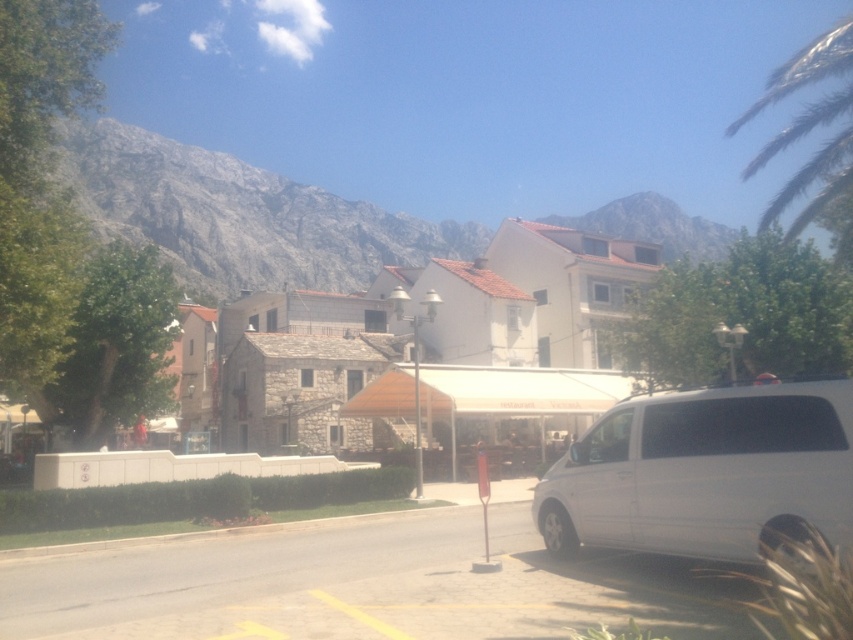
You are driving a delivery truck that is 6 meters long. You need to park your truck in the street where the white matte minivan at lower right is currently parked. Is there enough space to park your truck without overlapping the minivan?

The distance between the white matte minivan at lower right and the other object is 7.04 meters. Since your truck is 6 meters long, there is enough space to park without overlapping the minivan.

You are a hiker planning to take a photo of the gray rock mountain at upper left from the town square. Based on its position in the image, which direction should you face to capture it in your shot?

The gray rock mountain at upper left is located at point (241,216), which corresponds to the upper left area of the image. To capture it, you should face towards the upper left direction from the town square.

You are planning to install a new communication tower between the gray rock mountain at upper left and the green leafy palm tree at upper right. Considering the distance between them, what is the minimum length of the cable needed to connect the two points directly?

The gray rock mountain at upper left and green leafy palm tree at upper right are 251.09 feet apart from each other, so the minimum length of the cable needed to connect them directly would be 251.09 feet.